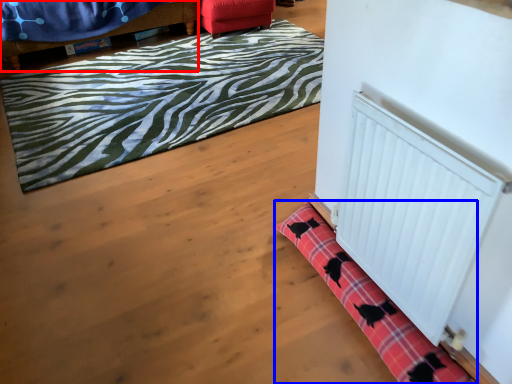
Question: Which object appears closest to the camera in this image, furniture (highlighted by a red box) or bath mat (highlighted by a blue box)?

Choices:
 (A) furniture
 (B) bath mat

Answer: (B)